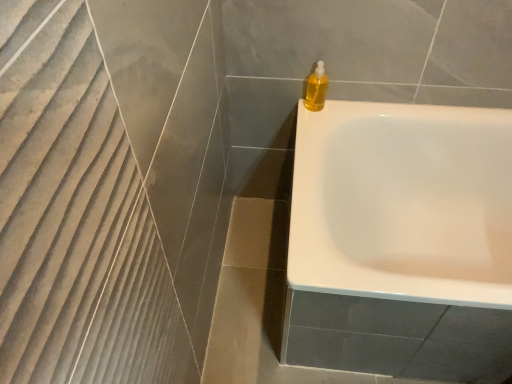
Image resolution: width=512 pixels, height=384 pixels. I want to click on free point in front of translucent yellow liquid at upper right, so click(308, 123).